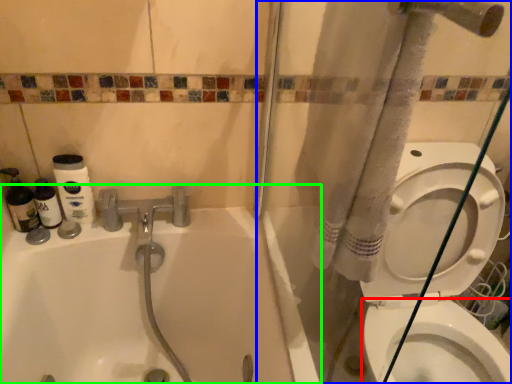
Question: Which object is positioned farthest from bidet (highlighted by a red box)? Select from shower door (highlighted by a blue box) and bathtub (highlighted by a green box).

Choices:
 (A) shower door
 (B) bathtub

Answer: (B)